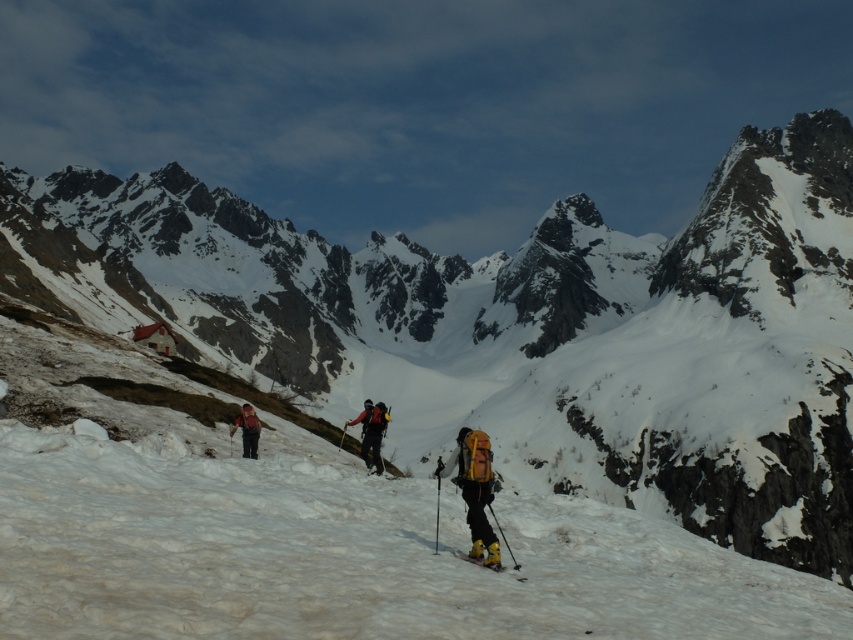
You are standing at the point with coordinates point (248, 448) and want to move towards the point with coordinates point (515, 568). Will you be moving away from or towards the mountains in the background?

Since point (248, 448) is closer to you than point (515, 568), moving from point (248, 448) to point (515, 568) means you are moving away from the mountains in the background.

You are planning to place a small emergency beacon on the slope where the yellow fabric backpack at center is located. The beacon requires a flat area of at least 10x10 cm. Is the area around point (474, 490) suitable?

The area around point (474, 490) has the yellow fabric backpack at center, so placing the beacon there would not be suitable as the backpack occupies the space.

From the picture: You are planning to carry both the matte black backpack at center and the matte red backpack at center during a winter hike. Based on the image, which backpack is taller?

The matte black backpack at center is taller than the matte red backpack at center according to the description.